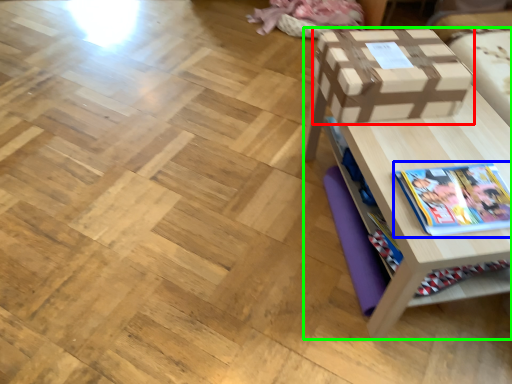
Question: Based on their relative distances, which object is farther from box (highlighted by a red box)? Choose from book (highlighted by a blue box) and table (highlighted by a green box).

Choices:
 (A) book
 (B) table

Answer: (A)